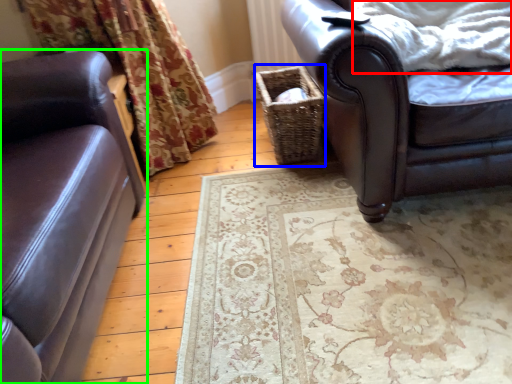
Question: Considering the real-world distances, which object is closest to blanket (highlighted by a red box)? basket (highlighted by a blue box) or studio couch (highlighted by a green box).

Choices:
 (A) basket
 (B) studio couch

Answer: (A)